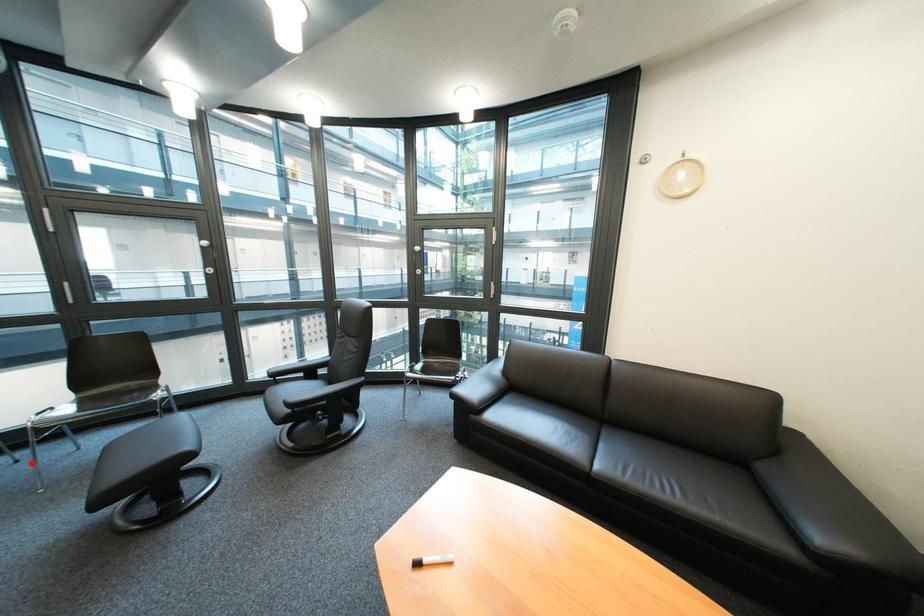
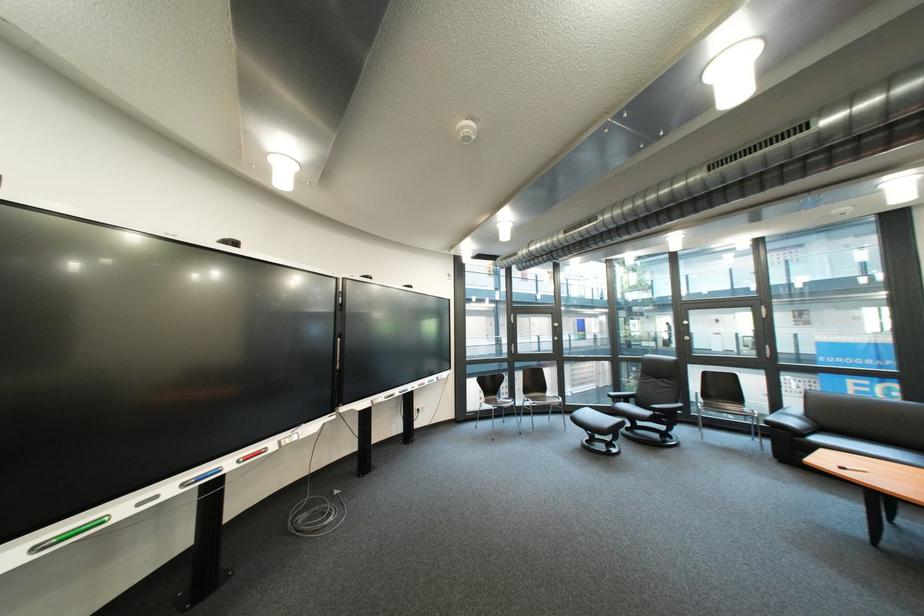
Question: I am providing you with two images of the same scene from different viewpoints. In image1, a red point is highlighted. Considering the same 3D point in image2, which of the following is correct?

Choices:
 (A) It is closer
 (B) It is farther

Answer: (B)